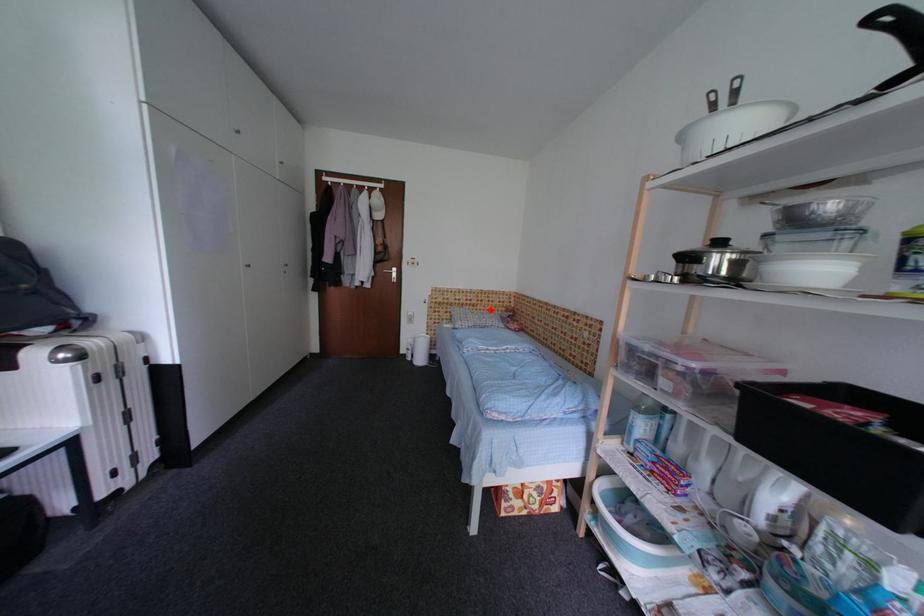
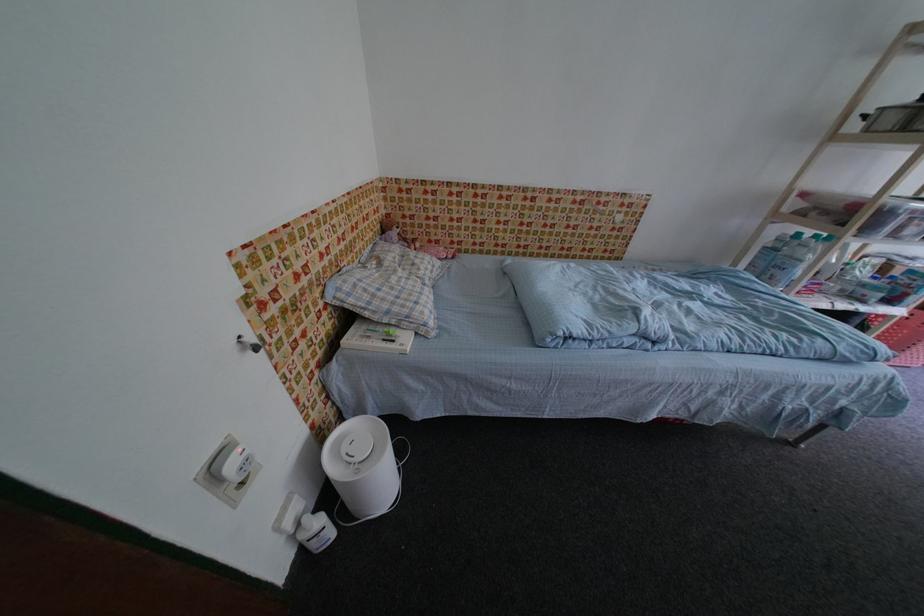
The point at the highlighted location is marked in the first image. Where is the corresponding point in the second image?

(370, 246)